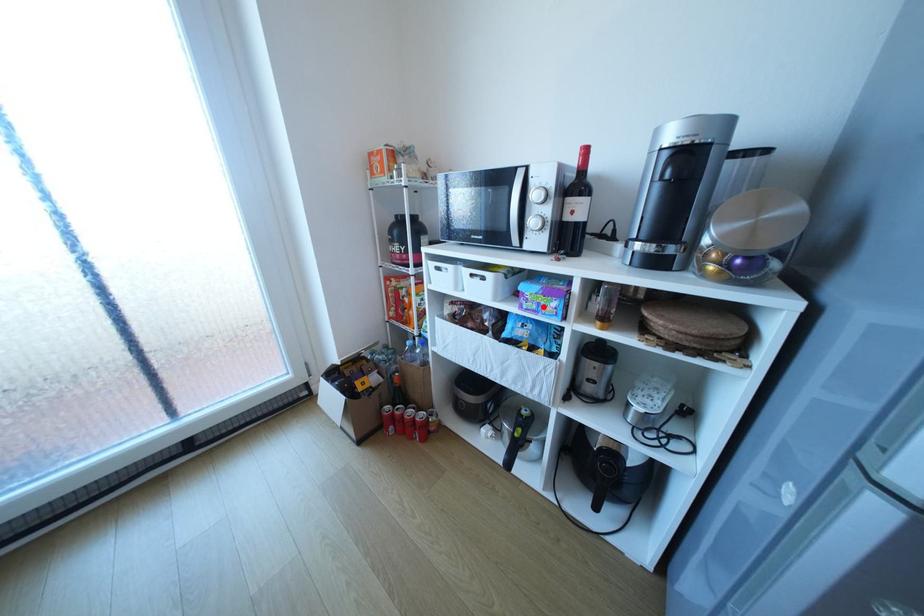
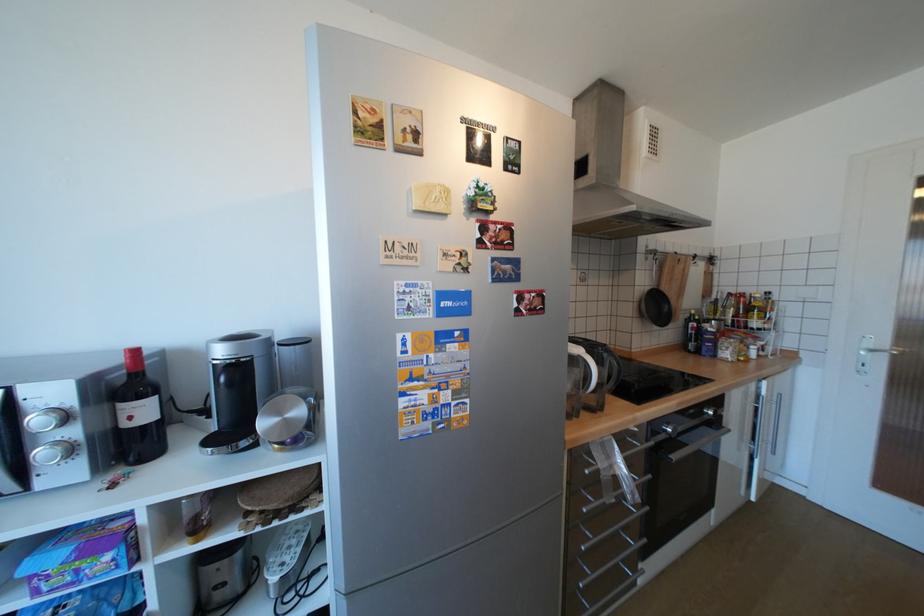
The point at the highlighted location is marked in the first image. Where is the corresponding point in the second image?

(79, 578)